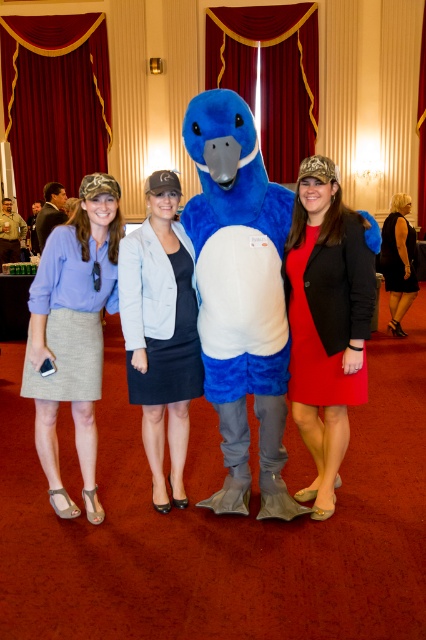
Which is above, light gray woven skirt at left or dark blue fabric dress at center?

Positioned higher is light gray woven skirt at left.

Who is shorter, light gray woven skirt at left or dark blue fabric dress at center?

With less height is dark blue fabric dress at center.

What do you see at coordinates (71, 316) in the screenshot? I see `light gray woven skirt at left` at bounding box center [71, 316].

You are a GUI agent. You are given a task and a screenshot of the screen. Output one action in this format:
    pyautogui.click(x=<x>, y=<y>)
    Task: Click on the light gray woven skirt at left
    The image size is (426, 640).
    Given the screenshot: What is the action you would take?
    pyautogui.click(x=71, y=316)

Does point (62, 378) lie behind point (176, 339)?

That is False.

Can you confirm if matte gray skirt at left is positioned below dark blue fabric dress at center?

Correct, matte gray skirt at left is located below dark blue fabric dress at center.

Does point (94, 285) lie in front of point (198, 369)?

Yes, it is.

Find the location of `matte gray skirt at left`. matte gray skirt at left is located at coordinates pos(72,333).

Who is taller, fuzzy blue mascot at center or matte blue dress at center?

With more height is fuzzy blue mascot at center.

Between point (233, 196) and point (172, 188), which one is positioned behind?

Point (172, 188)

The image size is (426, 640). Identify the location of fuzzy blue mascot at center. (239, 296).